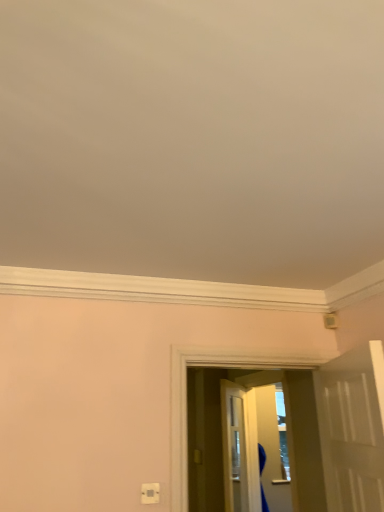
Question: Can you confirm if white plastic electric outlet at lower center is bigger than transparent plastic screen door at center?

Choices:
 (A) no
 (B) yes

Answer: (A)

Question: Can we say white plastic electric outlet at lower center lies outside transparent plastic screen door at center?

Choices:
 (A) yes
 (B) no

Answer: (A)

Question: Does white plastic electric outlet at lower center have a greater height compared to transparent plastic screen door at center?

Choices:
 (A) no
 (B) yes

Answer: (A)

Question: Would you consider white plastic electric outlet at lower center to be distant from transparent plastic screen door at center?

Choices:
 (A) no
 (B) yes

Answer: (B)

Question: Are white plastic electric outlet at lower center and transparent plastic screen door at center beside each other?

Choices:
 (A) no
 (B) yes

Answer: (A)

Question: Relative to white glossy door at right, is white plastic electric outlet at lower center in front or behind?

Choices:
 (A) behind
 (B) front

Answer: (A)

Question: Is white plastic electric outlet at lower center bigger or smaller than white glossy door at right?

Choices:
 (A) big
 (B) small

Answer: (B)

Question: From a real-world perspective, is white plastic electric outlet at lower center physically located above or below white glossy door at right?

Choices:
 (A) below
 (B) above

Answer: (A)

Question: Is white plastic electric outlet at lower center to the left or to the right of white glossy door at right in the image?

Choices:
 (A) right
 (B) left

Answer: (B)

Question: In terms of size, does white glossy door at right appear bigger or smaller than transparent plastic screen door at center?

Choices:
 (A) big
 (B) small

Answer: (A)

Question: Is point (370, 402) positioned closer to the camera than point (281, 458)?

Choices:
 (A) farther
 (B) closer

Answer: (B)

Question: Is white glossy door at right wider or thinner than transparent plastic screen door at center?

Choices:
 (A) wide
 (B) thin

Answer: (A)

Question: Do you think white glossy door at right is within transparent plastic screen door at center, or outside of it?

Choices:
 (A) inside
 (B) outside

Answer: (B)

Question: In terms of width, does white plastic electric outlet at lower center look wider or thinner when compared to transparent plastic screen door at center?

Choices:
 (A) wide
 (B) thin

Answer: (B)

Question: Is white plastic electric outlet at lower center inside the boundaries of transparent plastic screen door at center, or outside?

Choices:
 (A) outside
 (B) inside

Answer: (A)